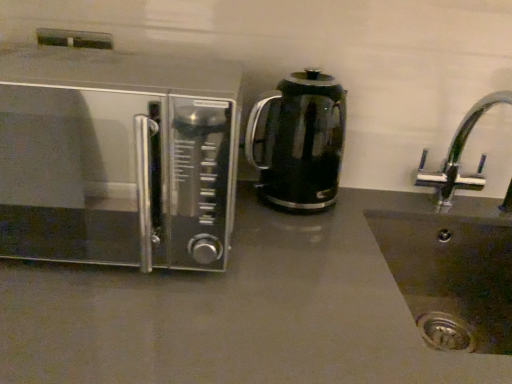
The image size is (512, 384). What do you see at coordinates (117, 158) in the screenshot? I see `satin silver microwave at left` at bounding box center [117, 158].

This screenshot has width=512, height=384. Describe the element at coordinates (459, 155) in the screenshot. I see `chrome metallic faucet at right` at that location.

Locate an element on the screen. The height and width of the screenshot is (384, 512). black glass kettle at center is located at coordinates (298, 141).

The width and height of the screenshot is (512, 384). I want to click on matte gray countertop at center, so click(x=241, y=310).

From the image's perspective, which is above, chrome metallic faucet at right or satin silver microwave at left?

satin silver microwave at left is shown above in the image.

Considering the positions of objects chrome metallic faucet at right and satin silver microwave at left in the image provided, who is more to the right, chrome metallic faucet at right or satin silver microwave at left?

Positioned to the right is chrome metallic faucet at right.

Considering the sizes of objects chrome metallic faucet at right and satin silver microwave at left in the image provided, who is bigger, chrome metallic faucet at right or satin silver microwave at left?

satin silver microwave at left.

Is chrome metallic faucet at right taller or shorter than satin silver microwave at left?

chrome metallic faucet at right is shorter than satin silver microwave at left.

From a real-world perspective, between satin silver microwave at left and black glass kettle at center, who is vertically higher?

satin silver microwave at left, from a real-world perspective.

Is point (122, 180) less distant than point (333, 100)?

No, it is not.

Is satin silver microwave at left facing away from black glass kettle at center?

No.

Measure the distance from satin silver microwave at left to black glass kettle at center.

The distance of satin silver microwave at left from black glass kettle at center is 7.62 inches.

How much distance is there between chrome metallic faucet at right and black glass kettle at center?

The distance of chrome metallic faucet at right from black glass kettle at center is 11.84 inches.

Is chrome metallic faucet at right oriented towards black glass kettle at center?

No.

Can you tell me how much chrome metallic faucet at right and black glass kettle at center differ in facing direction?

The facing directions of chrome metallic faucet at right and black glass kettle at center are 3.09 degrees apart.

Considering the relative positions of chrome metallic faucet at right and black glass kettle at center in the image provided, is chrome metallic faucet at right in front of black glass kettle at center?

That is True.

Does chrome metallic faucet at right have a lesser height compared to matte gray countertop at center?

Yes, chrome metallic faucet at right is shorter than matte gray countertop at center.

You are a GUI agent. You are given a task and a screenshot of the screen. Output one action in this format:
    pyautogui.click(x=<x>, y=<y>)
    Task: Click on the tap behind the matte gray countertop at center
    This screenshot has height=384, width=512.
    Given the screenshot: What is the action you would take?
    pos(459,155)

From a real-world perspective, is chrome metallic faucet at right below matte gray countertop at center?

No.

Is chrome metallic faucet at right wider or thinner than matte gray countertop at center?

→ In the image, chrome metallic faucet at right appears to be more narrow than matte gray countertop at center.

Visually, is black glass kettle at center positioned to the left or to the right of chrome metallic faucet at right?

Clearly, black glass kettle at center is on the left of chrome metallic faucet at right in the image.

Does black glass kettle at center have a lesser width compared to chrome metallic faucet at right?

Indeed, black glass kettle at center has a lesser width compared to chrome metallic faucet at right.

Find the location of a particular element. kitchen appliance behind the chrome metallic faucet at right is located at coordinates (298, 141).

Looking at this image, is black glass kettle at center spatially inside chrome metallic faucet at right, or outside of it?

black glass kettle at center is located beyond the bounds of chrome metallic faucet at right.

Which of these two, matte gray countertop at center or black glass kettle at center, stands taller?

With more height is matte gray countertop at center.

Is matte gray countertop at center looking in the opposite direction of black glass kettle at center?

No, black glass kettle at center is not at the back of matte gray countertop at center.

Considering the relative sizes of matte gray countertop at center and black glass kettle at center in the image provided, is matte gray countertop at center smaller than black glass kettle at center?

Incorrect, matte gray countertop at center is not smaller in size than black glass kettle at center.

How many degrees apart are the facing directions of matte gray countertop at center and black glass kettle at center?

The angular difference between matte gray countertop at center and black glass kettle at center is 3.09 degrees.

I want to click on counter top below the satin silver microwave at left (from the image's perspective), so click(x=241, y=310).

Does satin silver microwave at left turn towards matte gray countertop at center?

No, satin silver microwave at left is not aimed at matte gray countertop at center.

Which is more to the right, satin silver microwave at left or matte gray countertop at center?

Positioned to the right is matte gray countertop at center.

Locate an element on the screen. microwave oven that is on the left side of chrome metallic faucet at right is located at coordinates (117, 158).

Where is `microwave oven in front of the black glass kettle at center`? microwave oven in front of the black glass kettle at center is located at coordinates (117, 158).

Looking at the image, which one is located further to satin silver microwave at left, black glass kettle at center or chrome metallic faucet at right?

chrome metallic faucet at right.

Looking at the image, which one is located closer to black glass kettle at center, satin silver microwave at left or matte gray countertop at center?

satin silver microwave at left is closer to black glass kettle at center.

Based on their spatial positions, is chrome metallic faucet at right or black glass kettle at center closer to matte gray countertop at center?

black glass kettle at center.

Looking at the image, which one is located further to satin silver microwave at left, chrome metallic faucet at right or black glass kettle at center?

chrome metallic faucet at right lies further to satin silver microwave at left than the other object.

Considering their positions, is chrome metallic faucet at right positioned further to black glass kettle at center than matte gray countertop at center?

chrome metallic faucet at right is positioned further to the anchor black glass kettle at center.

Considering their positions, is black glass kettle at center positioned closer to matte gray countertop at center than chrome metallic faucet at right?

black glass kettle at center is closer to matte gray countertop at center.

From the image, which object appears to be nearer to chrome metallic faucet at right, satin silver microwave at left or matte gray countertop at center?

matte gray countertop at center is positioned closer to the anchor chrome metallic faucet at right.

Based on their spatial positions, is matte gray countertop at center or chrome metallic faucet at right closer to black glass kettle at center?

matte gray countertop at center lies closer to black glass kettle at center than the other object.

This screenshot has width=512, height=384. Identify the location of microwave oven between black glass kettle at center and matte gray countertop at center in the vertical direction. (117, 158).

Find the location of `tap between black glass kettle at center and matte gray countertop at center in the up-down direction`. tap between black glass kettle at center and matte gray countertop at center in the up-down direction is located at coordinates (459, 155).

Identify the location of counter top between satin silver microwave at left and chrome metallic faucet at right. The image size is (512, 384). (241, 310).

The image size is (512, 384). In order to click on kitchen appliance situated between satin silver microwave at left and chrome metallic faucet at right from left to right in this screenshot , I will do `click(298, 141)`.